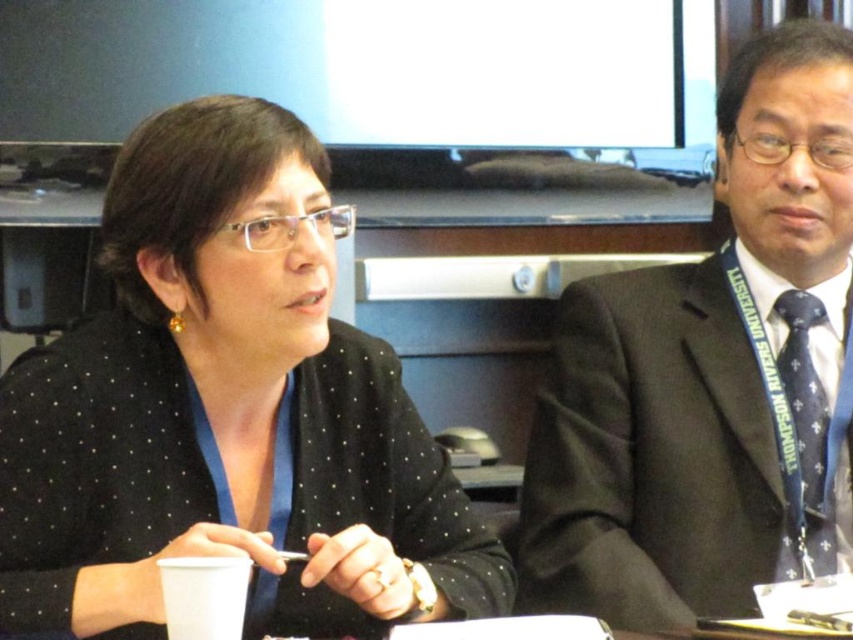
In the scene shown: You are a photographer wanting to take a closeup of the black suit at center and the dark blue textured tie at right. Which object should you focus on first to ensure it appears sharp in the photo?

The black suit at center is closer to the viewer than the dark blue textured tie at right, so you should focus on the black suit at center first to ensure it appears sharp.

You are standing in front of a conference table where a woman in a black dotted blazer at upper left is sitting. You need to place a 36 inch wide banner on the table between you and her. Will it fit without overlapping her?

The distance between you and the black dotted blazer at upper left is 37.59 inches. Since the banner is 36 inches wide, it will fit as it is narrower than the available space.